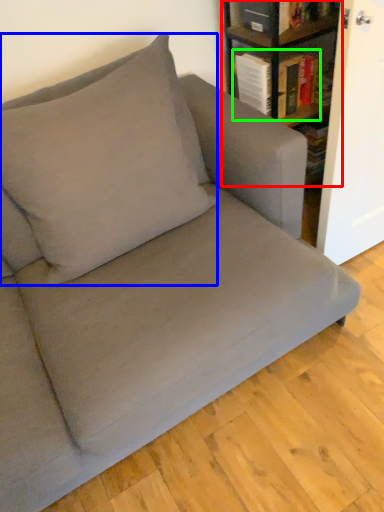
Question: Which is nearer to the shelf (highlighted by a red box)? throw pillow (highlighted by a blue box) or book (highlighted by a green box).

Choices:
 (A) throw pillow
 (B) book

Answer: (B)